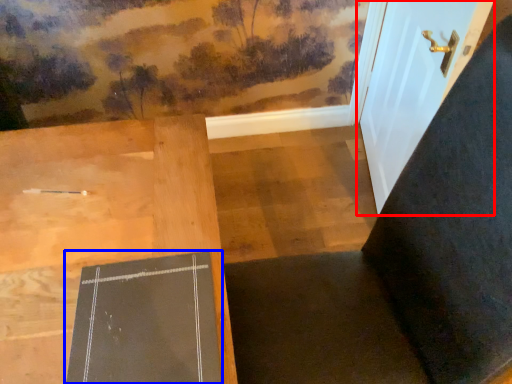
Question: Which object appears farthest to the camera in this image, door (highlighted by a red box) or bulletin board (highlighted by a blue box)?

Choices:
 (A) door
 (B) bulletin board

Answer: (A)